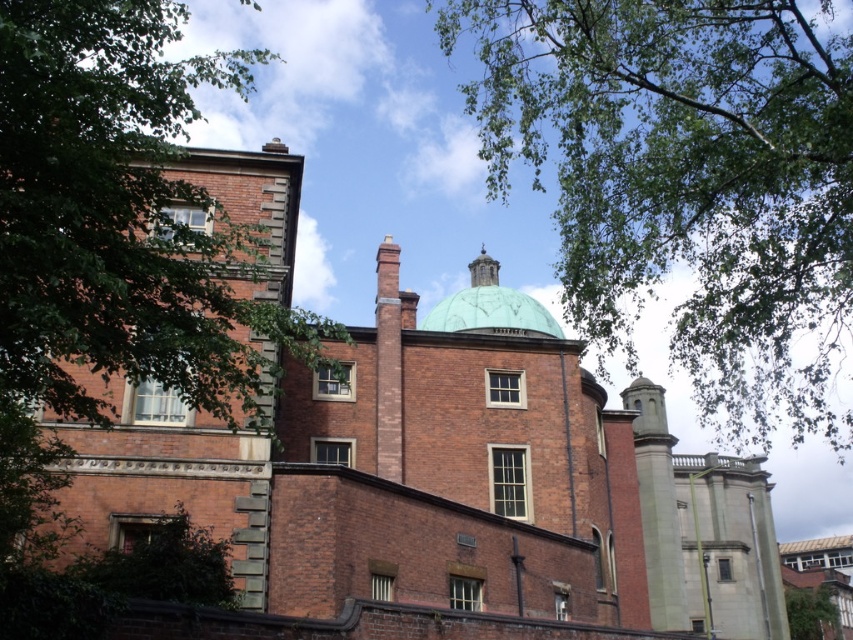
You are standing at the point marked as point (503, 51) in the image. The historic brick building with a green dome is in front of you. If you want to take a photo of the entire building, would you need to move closer or farther away from the building?

Since you are 48.48 meters away from point (503, 51), which is your current position, you are quite far from the building. To capture the entire historic brick building with the green dome in one photo, you might need to move slightly closer to ensure the entire structure fits within the camera frame. However, being at this distance already allows for a wide view, so it depends on the camera lens used. A wide angle lens might suffice without needing to move closer.

You are an architect assessing the building. You need to determine if the green leafy tree at upper center can be safely pruned without affecting the structural integrity of the green matte dome at center. Based on their widths, is the tree wider than the dome?

The green leafy tree at upper center is wider than the green matte dome at center, so pruning the tree would not directly impact the dome since the tree is wider and likely does not encroach on the dome.